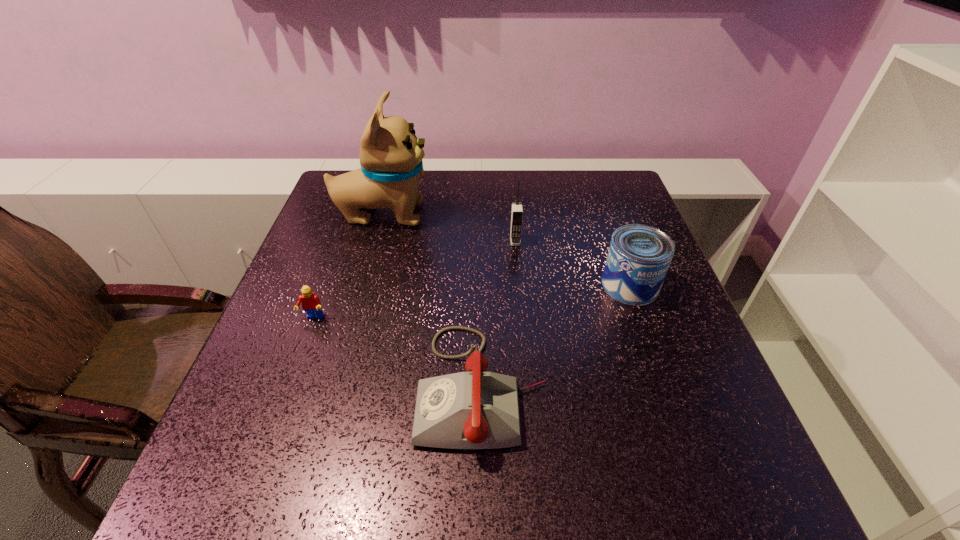
This screenshot has width=960, height=540. In order to click on free space located 0.300m on the front label of the can in this screenshot , I will do [683, 433].

At what (x,y) coordinates should I click in order to perform the action: click on vacant space located 0.320m on the dial of the nearest object. Please return your answer as a coordinate pair (x, y). The width and height of the screenshot is (960, 540). Looking at the image, I should click on (248, 386).

I want to click on vacant space positioned on the dial of the nearest object, so click(349, 386).

Image resolution: width=960 pixels, height=540 pixels. What are the coordinates of `vacant position located on the dial of the nearest object` in the screenshot? It's located at (381, 386).

Image resolution: width=960 pixels, height=540 pixels. Find the location of `vacant space situated on the front-facing side of the fourth farthest object`. vacant space situated on the front-facing side of the fourth farthest object is located at coordinates (246, 500).

Image resolution: width=960 pixels, height=540 pixels. What are the coordinates of `object that is at the far edge` in the screenshot? It's located at (391, 156).

Find the location of a particular element. puppy that is at the left edge is located at coordinates (391, 156).

I want to click on Lego that is at the left edge, so click(x=311, y=304).

At what (x,y) coordinates should I click in order to perform the action: click on object situated at the right edge. Please return your answer as a coordinate pair (x, y). The height and width of the screenshot is (540, 960). Looking at the image, I should click on (639, 256).

The width and height of the screenshot is (960, 540). In order to click on object at the far left corner in this screenshot , I will do `click(391, 156)`.